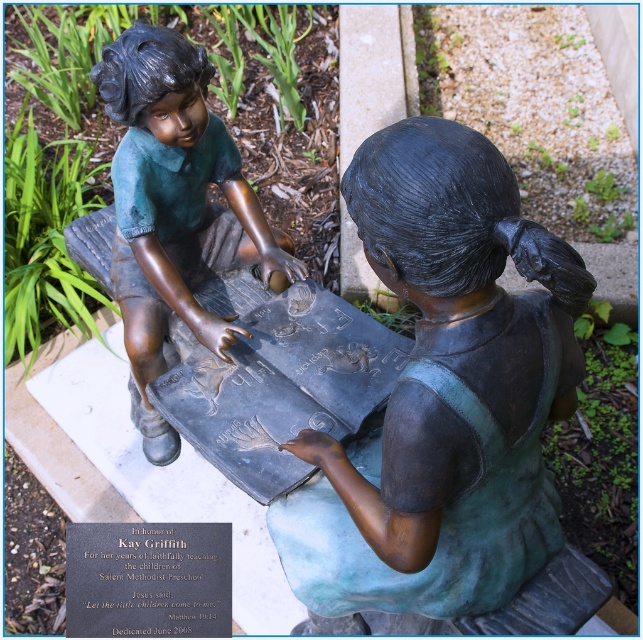
Does green patina bronze statue at center have a lesser height compared to bronze statue at upper left?

→ Yes.

Can you confirm if green patina bronze statue at center is positioned below bronze statue at upper left?

Indeed, green patina bronze statue at center is positioned under bronze statue at upper left.

Where is `green patina bronze statue at center`? The width and height of the screenshot is (643, 640). green patina bronze statue at center is located at coordinates (444, 392).